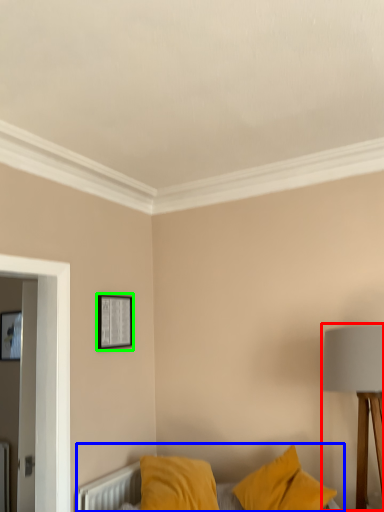
Question: Based on their relative distances, which object is farther from table lamp (highlighted by a red box)? Choose from bed (highlighted by a blue box) and picture frame (highlighted by a green box).

Choices:
 (A) bed
 (B) picture frame

Answer: (A)